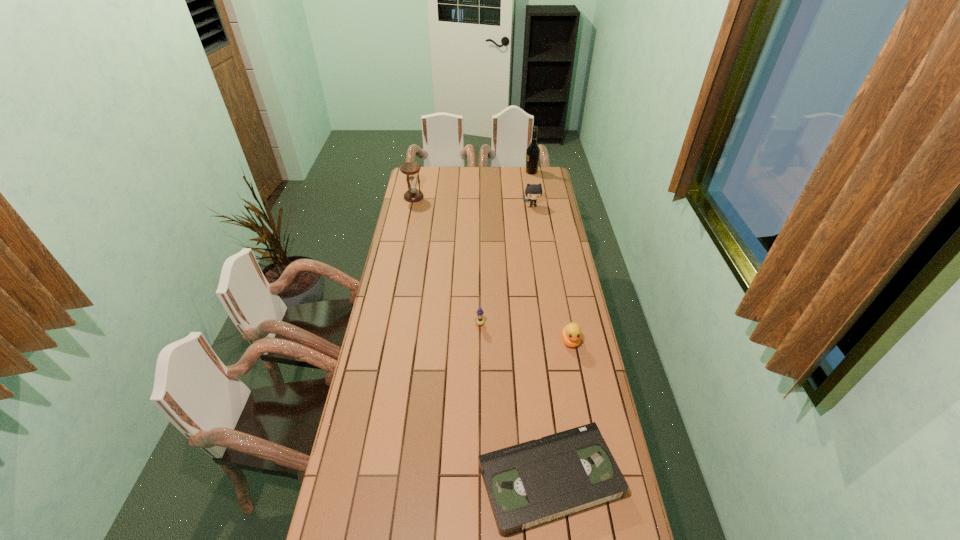
This screenshot has height=540, width=960. Find the location of `videotape`. videotape is located at coordinates (538, 481).

Where is `vacant position located on the label of the wine bottle`? The height and width of the screenshot is (540, 960). vacant position located on the label of the wine bottle is located at coordinates coord(489,172).

This screenshot has height=540, width=960. Find the location of `free spot located on the label of the wine bottle`. free spot located on the label of the wine bottle is located at coordinates (498, 172).

The image size is (960, 540). I want to click on blank space located 0.180m on the label of the wine bottle, so click(495, 172).

Identify the location of vacant point located 0.350m on the right of the leftmost object. The image size is (960, 540). (486, 197).

Image resolution: width=960 pixels, height=540 pixels. Identify the location of vacant region located on the front-facing side of the kitten. (537, 231).

Find the location of a particular element. free space located on the face of the fifth farthest object is located at coordinates (580, 392).

Locate an element on the screen. The height and width of the screenshot is (540, 960). free space located 0.110m on the face of the third nearest object, where the monocle is placed is located at coordinates (480, 350).

The height and width of the screenshot is (540, 960). What are the coordinates of `vacant space located 0.350m on the back of the videotape` in the screenshot? It's located at (535, 347).

This screenshot has height=540, width=960. Identify the location of object located in the far edge section of the desktop. (533, 151).